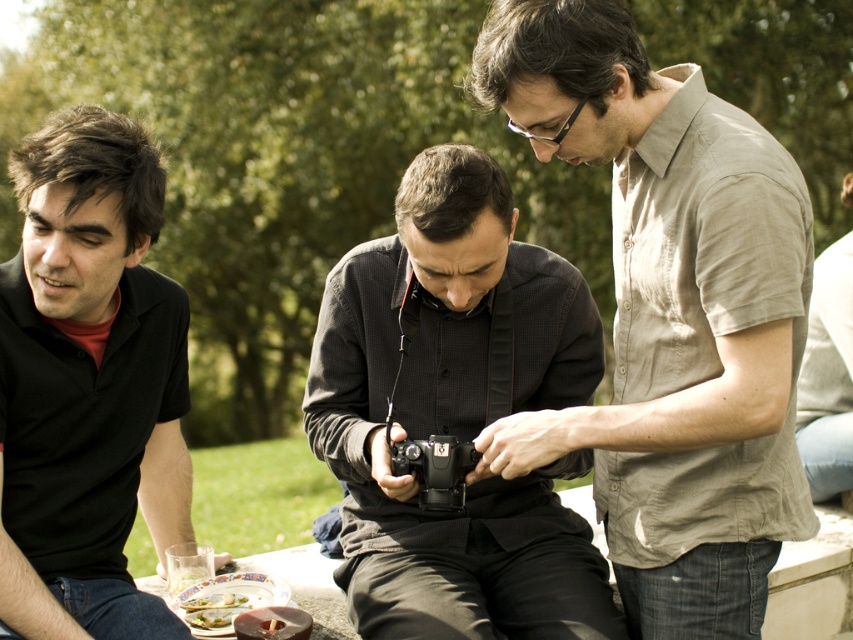
Question: Among these points, which one is nearest to the camera?

Choices:
 (A) (225, 616)
 (B) (846, 316)

Answer: (A)

Question: Can you confirm if black textured shirt at center is thinner than green leafy vegetable at lower left?

Choices:
 (A) yes
 (B) no

Answer: (B)

Question: Which point is closer to the camera?

Choices:
 (A) (813, 288)
 (B) (216, 604)
 (C) (786, 218)
 (D) (422, 456)

Answer: (C)

Question: Observing the image, what is the correct spatial positioning of black textured shirt at center in reference to green leafy vegetable at lower left?

Choices:
 (A) above
 (B) below

Answer: (A)

Question: Does black matte shirt at left appear over black plastic camera at center?

Choices:
 (A) no
 (B) yes

Answer: (B)

Question: Which of the following is the farthest from the observer?

Choices:
 (A) light beige cotton shirt at center
 (B) green leafy salad at lower center
 (C) black plastic camera at center

Answer: (B)